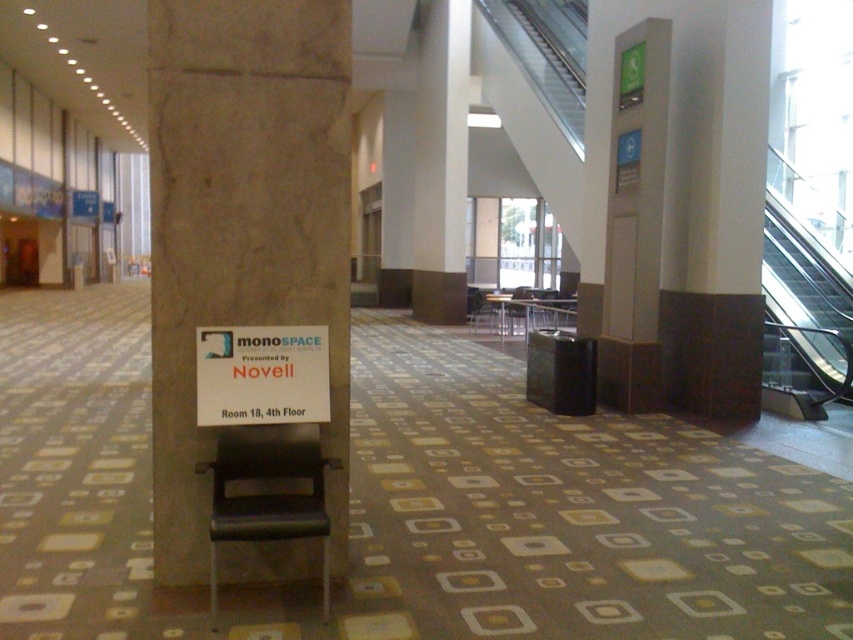
Question: Can you confirm if brown marble pillar at center is thinner than white paper sign at center?

Choices:
 (A) no
 (B) yes

Answer: (A)

Question: Is brown marble pillar at center in front of white paper sign at center?

Choices:
 (A) yes
 (B) no

Answer: (A)

Question: Based on their relative distances, which object is farther from the black glass stairs at upper right?

Choices:
 (A) brown marble pillar at center
 (B) gray concrete pillar at right

Answer: (A)

Question: Estimate the real-world distances between objects in this image. Which object is farther from the gray concrete pillar at right?

Choices:
 (A) white paper sign at center
 (B) brown marble pillar at center

Answer: (A)

Question: Which object appears closest to the camera in this image?

Choices:
 (A) black glass stairs at upper right
 (B) white paper sign at center
 (C) brown marble pillar at center
 (D) gray concrete pillar at right

Answer: (C)

Question: Can you confirm if brown marble pillar at center is positioned below gray concrete pillar at right?

Choices:
 (A) no
 (B) yes

Answer: (B)